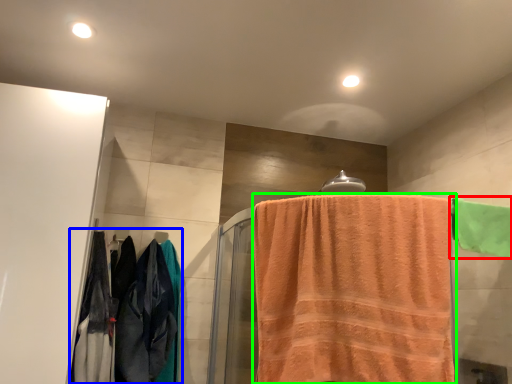
Question: Estimate the real-world distances between objects in this image. Which object is closer to towel (highlighted by a red box), clothing (highlighted by a blue box) or towel (highlighted by a green box)?

Choices:
 (A) clothing
 (B) towel

Answer: (B)